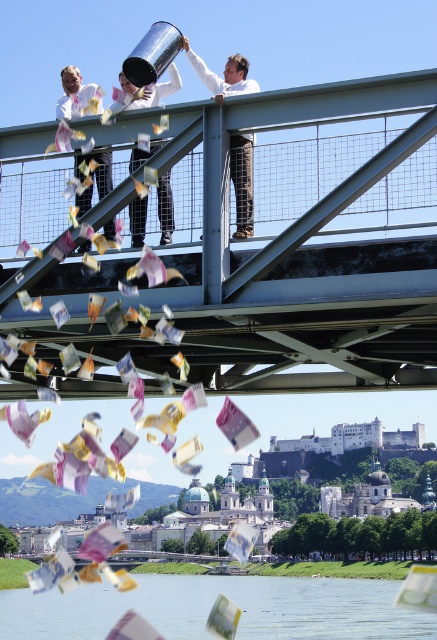
Question: Which point is farther to the camera?

Choices:
 (A) transparent water at lower center
 (B) white cotton shirt at center
 (C) matte white shirt at left

Answer: (A)

Question: Is camouflage pants at center smaller than matte white shirt at left?

Choices:
 (A) no
 (B) yes

Answer: (B)

Question: From the image, what is the correct spatial relationship of camouflage pants at center in relation to white cotton shirt at center?

Choices:
 (A) left
 (B) right

Answer: (B)

Question: Which point is closer to the camera?

Choices:
 (A) camouflage pants at center
 (B) metallic steel bridge at upper center
 (C) transparent water at lower center

Answer: (B)

Question: Which object is the closest to the white cotton shirt at center?

Choices:
 (A) camouflage pants at center
 (B) transparent water at lower center
 (C) metallic steel bridge at upper center

Answer: (A)

Question: Is metallic steel bridge at upper center wider than camouflage pants at center?

Choices:
 (A) no
 (B) yes

Answer: (B)